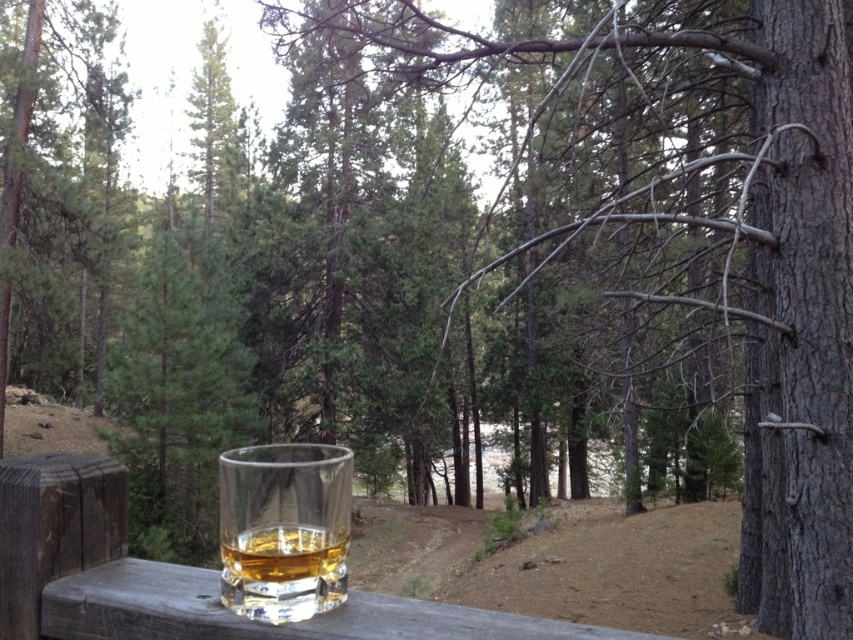
Question: In this image, where is green matte tree at center located relative to translucent glass at lower center?

Choices:
 (A) right
 (B) left

Answer: (B)

Question: Is green matte tree at center to the right of translucent glass at lower center from the viewer's perspective?

Choices:
 (A) no
 (B) yes

Answer: (A)

Question: In this image, where is green matte tree at center located relative to translucent glass at lower center?

Choices:
 (A) above
 (B) below

Answer: (B)

Question: Which object is farther from the camera taking this photo?

Choices:
 (A) green matte tree at center
 (B) translucent glass at lower center

Answer: (A)